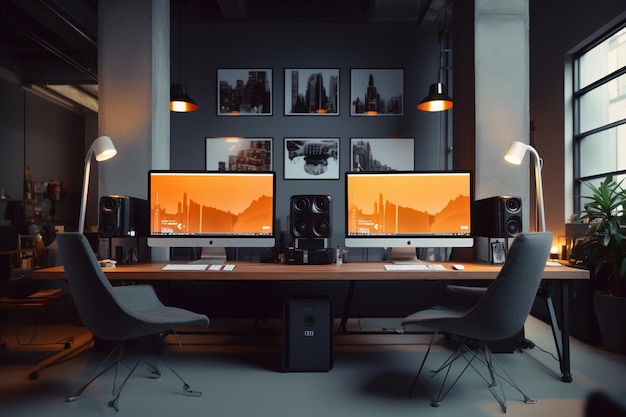
This screenshot has width=626, height=417. What are the coordinates of `computers` in the screenshot? It's located at (397, 219), (227, 214).